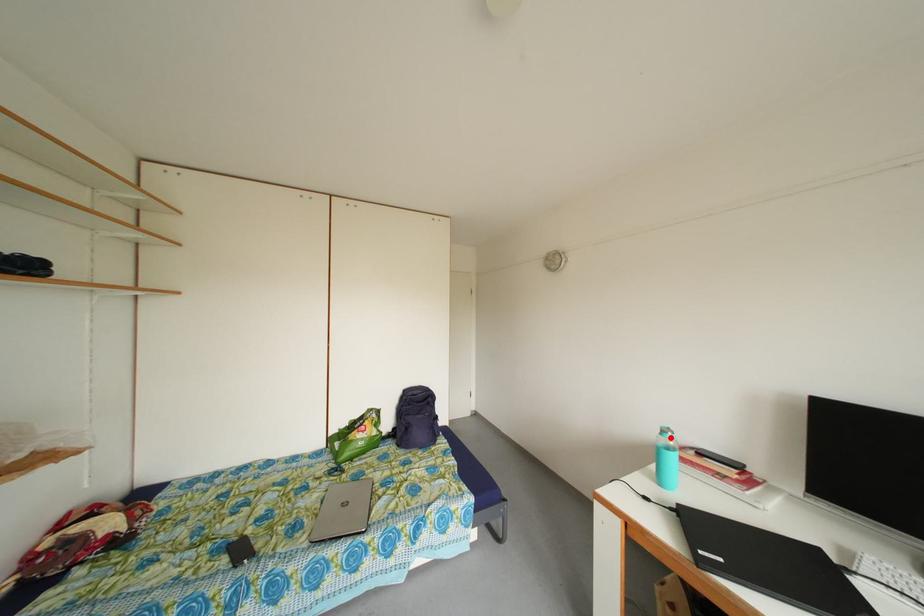
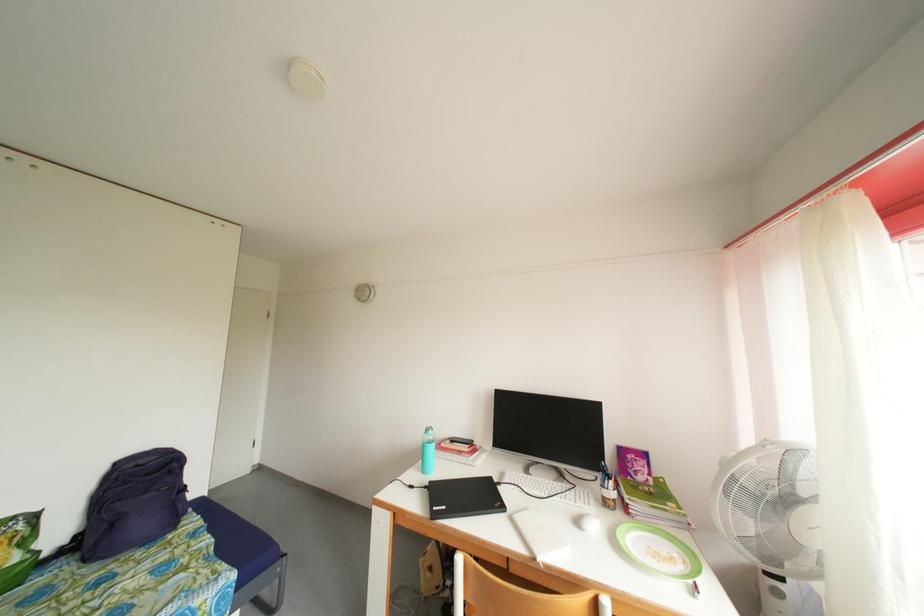
Question: I am providing you with two images of the same scene from different viewpoints. Given a red point in image1, look at the same physical point in image2. Is it:

Choices:
 (A) Closer to the viewpoint
 (B) Farther from the viewpoint

Answer: (B)